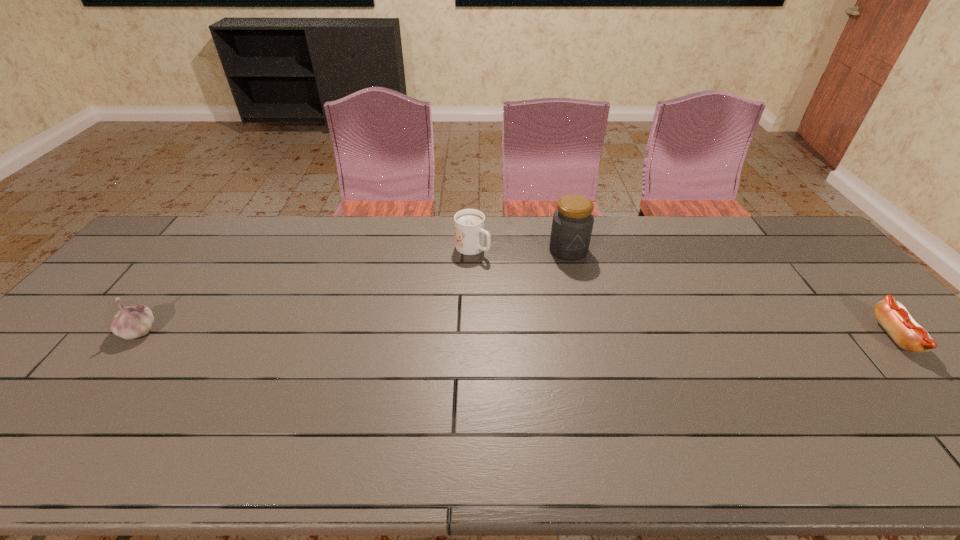
Where is `free space located on the surface of the jar near the warning symbol`? free space located on the surface of the jar near the warning symbol is located at coordinates (588, 312).

At what (x,y) coordinates should I click in order to perform the action: click on free spot located 0.060m on the side with the handle of the cappuccino. Please return your answer as a coordinate pair (x, y). Image resolution: width=960 pixels, height=540 pixels. Looking at the image, I should click on (497, 266).

Find the location of a particular element. blank space located on the side with the handle of the cappuccino is located at coordinates (557, 306).

Identify the location of vacant space positioned 0.180m on the side with the handle of the cappuccino. (526, 285).

Where is `jar that is positioned at the far edge`? The image size is (960, 540). jar that is positioned at the far edge is located at coordinates (572, 224).

Find the location of a particular element. The image size is (960, 540). cappuccino present at the far edge is located at coordinates (469, 224).

Identify the location of object that is at the left edge. Image resolution: width=960 pixels, height=540 pixels. (136, 320).

Image resolution: width=960 pixels, height=540 pixels. Identify the location of object that is at the right edge. (894, 318).

You are a GUI agent. You are given a task and a screenshot of the screen. Output one action in this format:
    pyautogui.click(x=<x>, y=<y>)
    Task: Click on the free point at the far edge
    
    Given the screenshot: What is the action you would take?
    pyautogui.click(x=615, y=248)

Locate an element on the screen. vacant space at the near edge of the desktop is located at coordinates (795, 402).